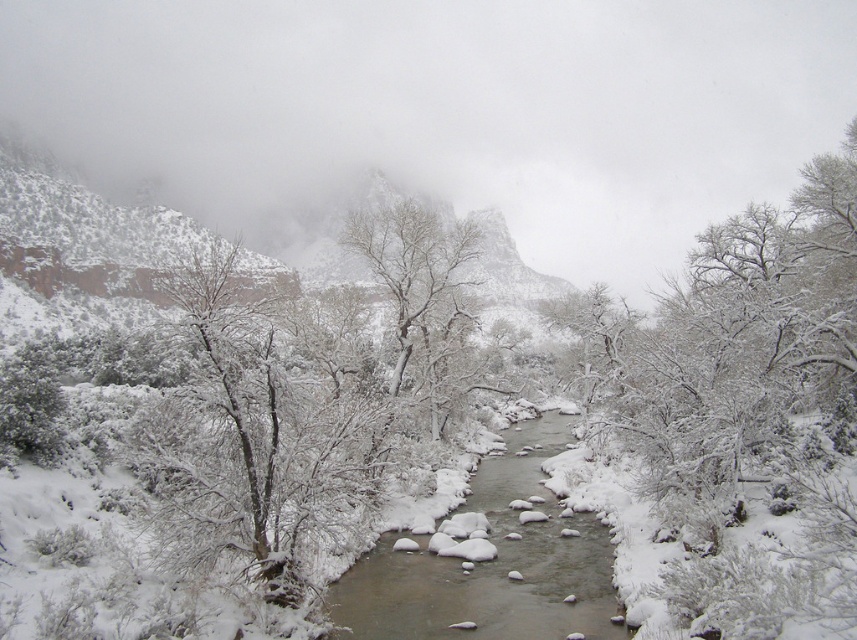
Question: Estimate the real-world distances between objects in this image. Which object is farther from the snow-covered branches at center?

Choices:
 (A) white snow-covered tree at center
 (B) white snowy stream at center

Answer: (A)

Question: From the image, what is the correct spatial relationship of white snow-covered tree at center in relation to snow-covered branches at center?

Choices:
 (A) above
 (B) below

Answer: (B)

Question: Can you confirm if white snow-covered tree at center is thinner than snow-covered branches at center?

Choices:
 (A) yes
 (B) no

Answer: (B)

Question: Does white snow-covered tree at center appear over white snowy stream at center?

Choices:
 (A) no
 (B) yes

Answer: (B)

Question: Which point is farther to the camera?

Choices:
 (A) (529, 438)
 (B) (613, 307)
 (C) (399, 394)

Answer: (A)

Question: Based on their relative distances, which object is nearer to the white snow-covered tree at center?

Choices:
 (A) white snowy stream at center
 (B) snow-covered branches at center

Answer: (A)